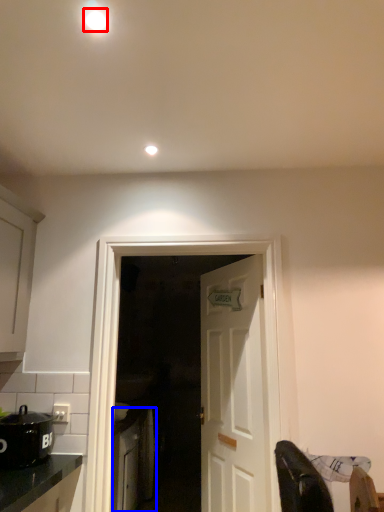
Question: Which of the following is the farthest to the observer, lighting (highlighted by a red box) or cabinetry (highlighted by a blue box)?

Choices:
 (A) lighting
 (B) cabinetry

Answer: (B)